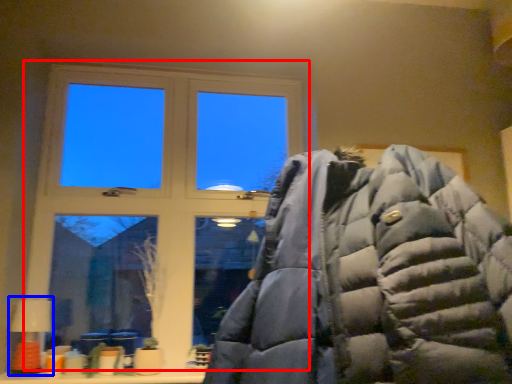
Question: Among these objects, which one is nearest to the camera, window (highlighted by a red box) or table lamp (highlighted by a blue box)?

Choices:
 (A) window
 (B) table lamp

Answer: (B)